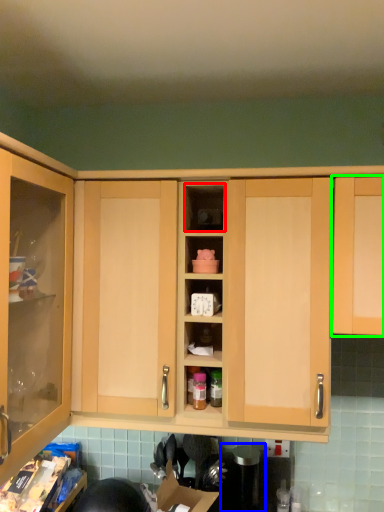
Question: Which is farther away from cabinet (highlighted by a red box)? appliance (highlighted by a blue box) or cabinetry (highlighted by a green box)?

Choices:
 (A) appliance
 (B) cabinetry

Answer: (A)